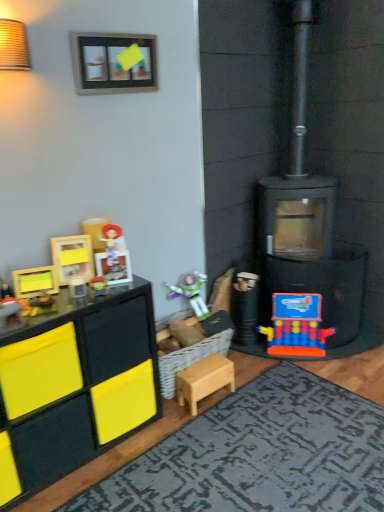
You are a GUI agent. You are given a task and a screenshot of the screen. Output one action in this format:
    pyautogui.click(x=<x>, y=<y>)
    Task: Click on the vacant region in front of orange plastic toy at lower right, the first toy when ordered from right to left
    
    Given the screenshot: What is the action you would take?
    pyautogui.click(x=330, y=368)